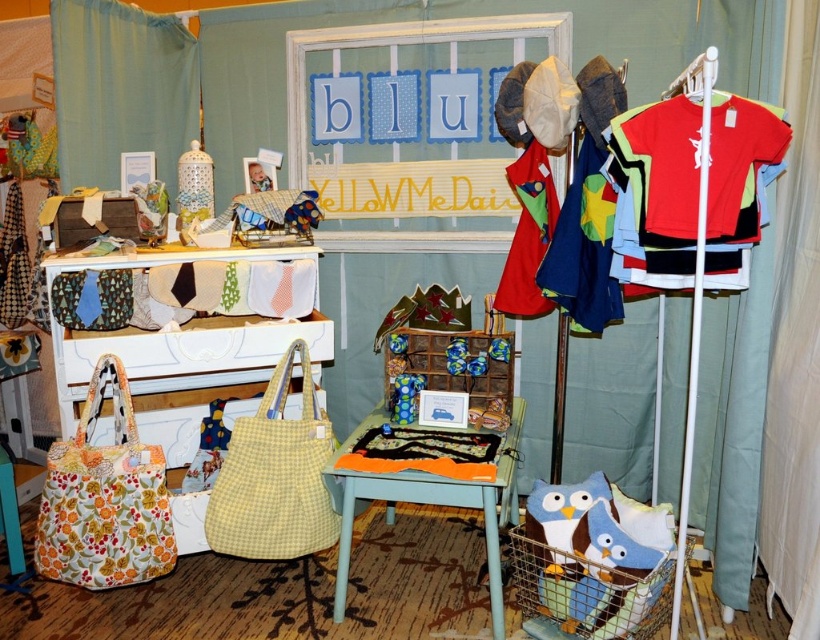
You are a customer at the craft fair and want to see the blue cotton shirt at right clearly. However, the white fabric curtain at right is blocking your view. Can you move the curtain to get a better look?

The white fabric curtain at right is below the blue cotton shirt at right, so you can move the curtain upwards to reveal the blue cotton shirt at right.